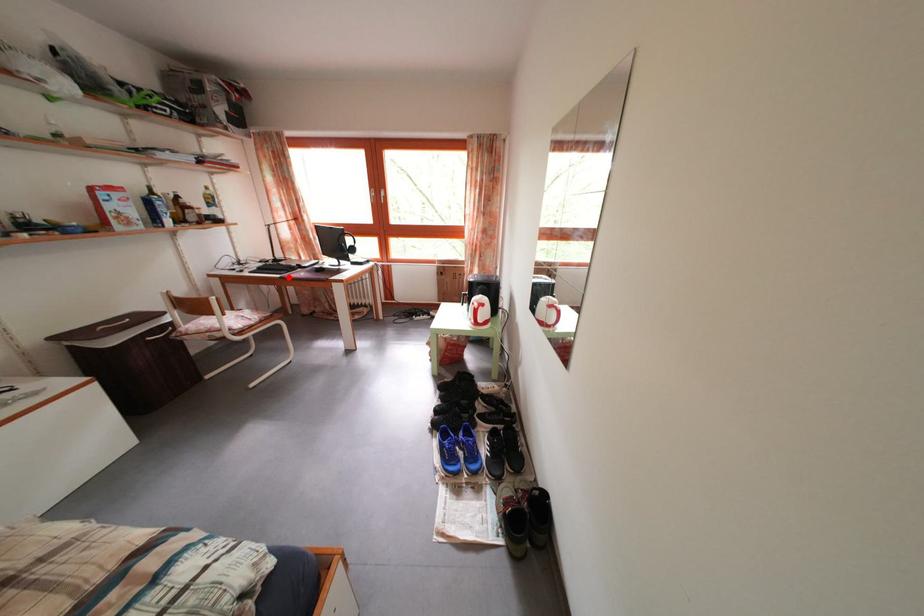
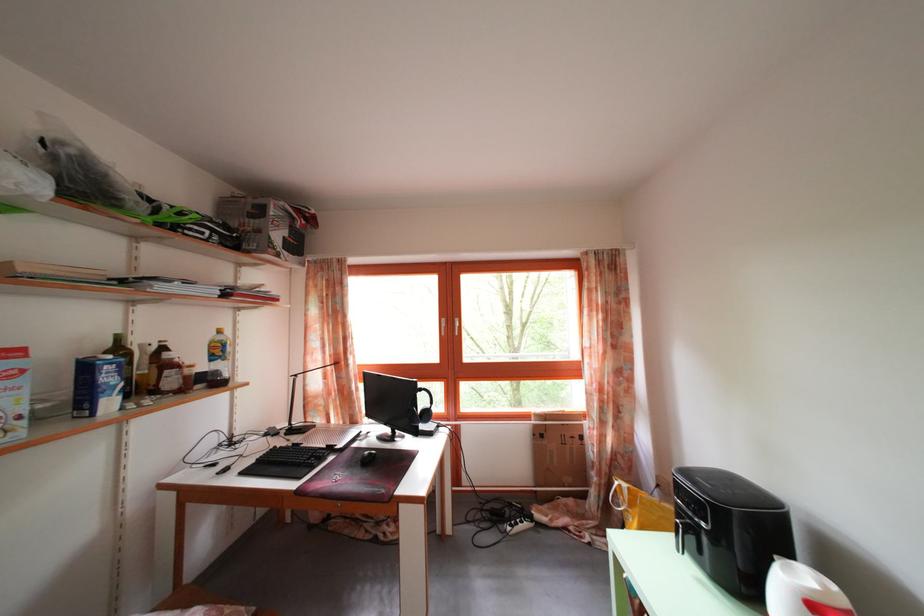
Question: I am providing you with two images of the same scene from different viewpoints. In image1, a red point is highlighted. Considering the same 3D point in image2, which of the following is correct?

Choices:
 (A) It is closer
 (B) It is farther

Answer: (B)